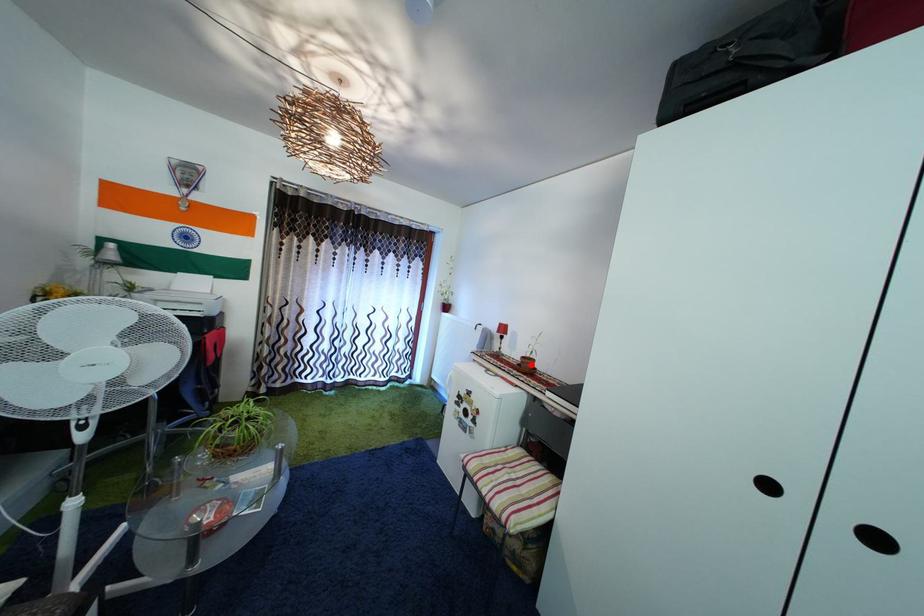
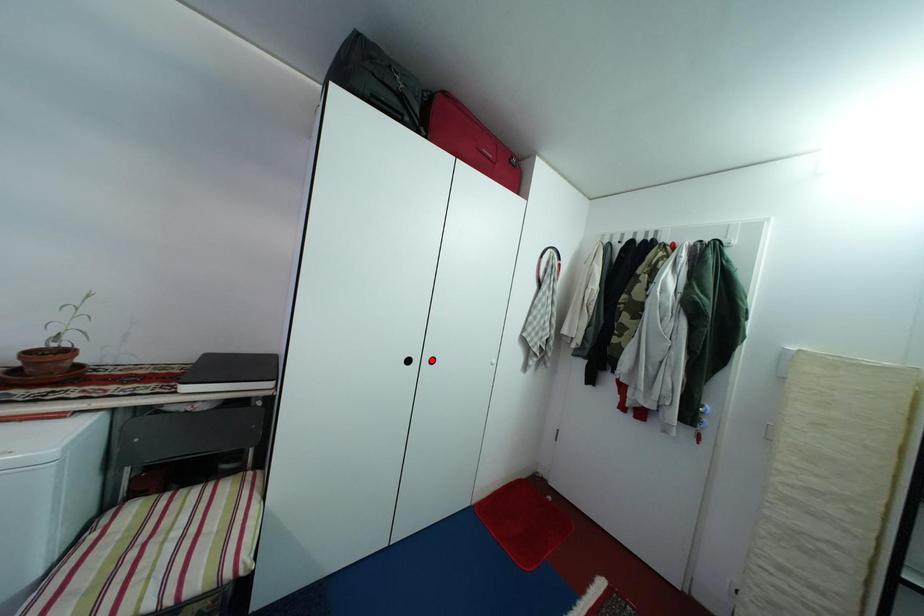
I am providing you with two images of the same scene from different viewpoints. A red point is marked on the first image and another point is marked on the second image. Do the highlighted points in image1 and image2 indicate the same real-world spot?

No